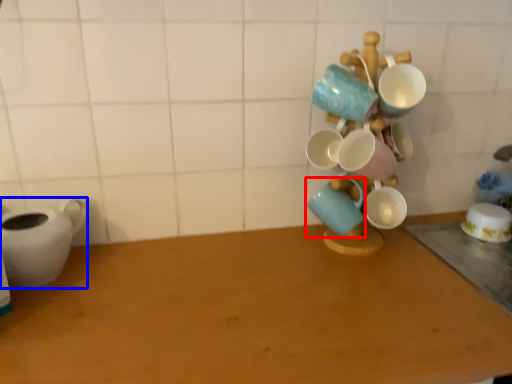
Question: Which point is closer to the camera, coffee cup (highlighted by a red box) or tableware (highlighted by a blue box)?

Choices:
 (A) coffee cup
 (B) tableware

Answer: (B)